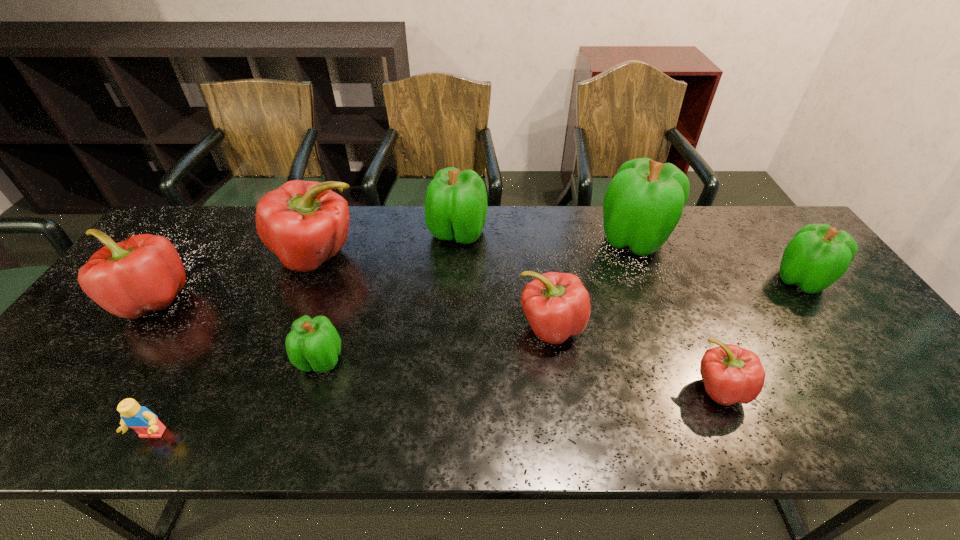
Locate an element on the screen. The height and width of the screenshot is (540, 960). the nearest green bell pepper is located at coordinates (314, 344).

This screenshot has width=960, height=540. I want to click on the leftmost green bell pepper, so tap(314, 344).

Find the location of a particular element. The image size is (960, 540). the rightmost pink bell pepper is located at coordinates (731, 374).

Identify the location of the nearest pink bell pepper. (731, 374).

I want to click on the eighth object from right to left, so click(x=139, y=418).

Identify the location of Lego. This screenshot has width=960, height=540. (139, 418).

Locate an element on the screen. This screenshot has width=960, height=540. vacant region located on the right of the second green bell pepper from right to left is located at coordinates (755, 239).

I want to click on vacant space located 0.300m on the front of the biggest pink bell pepper, so click(x=269, y=377).

I want to click on free space located on the front of the third green bell pepper from right to left, so click(x=455, y=282).

Find the location of a particular element. The image size is (960, 540). vacant space located on the front of the leftmost pink bell pepper is located at coordinates (62, 426).